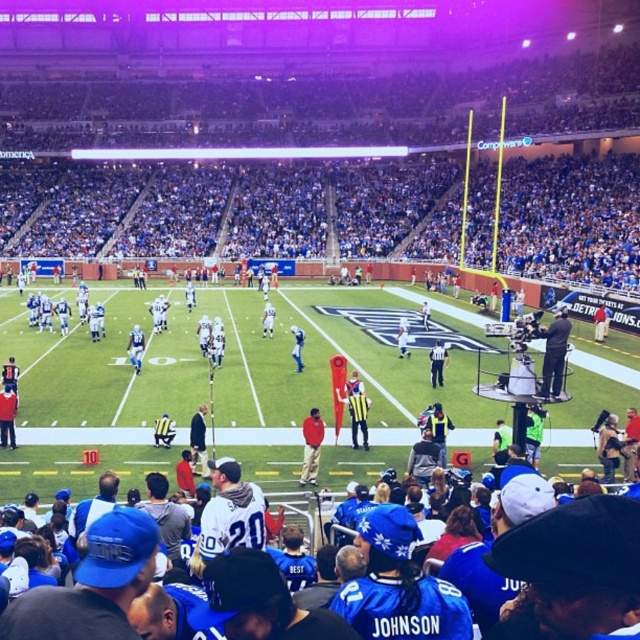
Question: Can you confirm if red matte jacket at center is positioned to the left of white uniformed official at center?

Choices:
 (A) no
 (B) yes

Answer: (B)

Question: Is black fabric camera at right in front of red matte jacket at center?

Choices:
 (A) yes
 (B) no

Answer: (A)

Question: Which of the following is the closest to the observer?

Choices:
 (A) (298, 364)
 (B) (12, 422)

Answer: (B)

Question: Does black fabric camera at right have a larger size compared to blue jersey at center?

Choices:
 (A) no
 (B) yes

Answer: (B)

Question: Among these points, which one is farthest from the camera?

Choices:
 (A) coord(316,449)
 (B) coord(429,349)
 (C) coord(138,369)

Answer: (B)

Question: Estimate the real-world distances between objects in this image. Which object is farther from the red fabric jacket at lower left?

Choices:
 (A) white matte jersey at center
 (B) white jersey at center

Answer: (A)